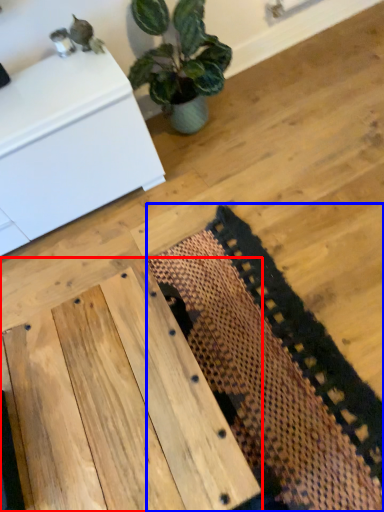
Question: Which object appears farthest to the camera in this image, table (highlighted by a red box) or mat (highlighted by a blue box)?

Choices:
 (A) table
 (B) mat

Answer: (B)